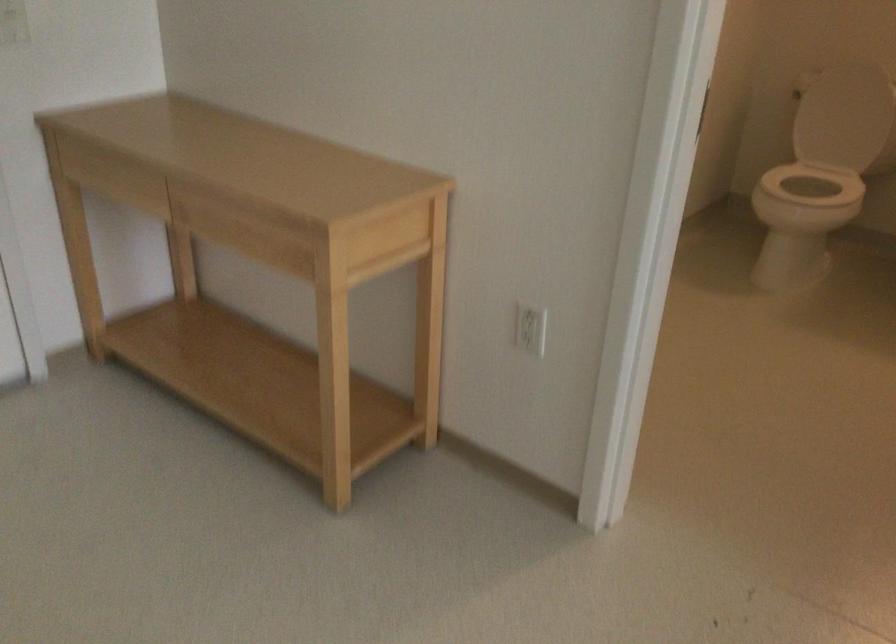
Describe the element at coordinates (814, 184) in the screenshot. I see `a white toilet seat` at that location.